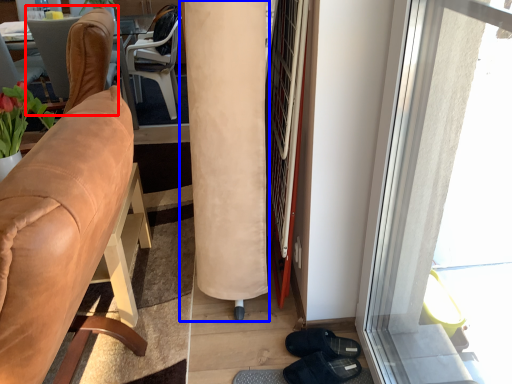
Question: Which of the following is the farthest to the observer, chair (highlighted by a red box) or curtain (highlighted by a blue box)?

Choices:
 (A) chair
 (B) curtain

Answer: (A)